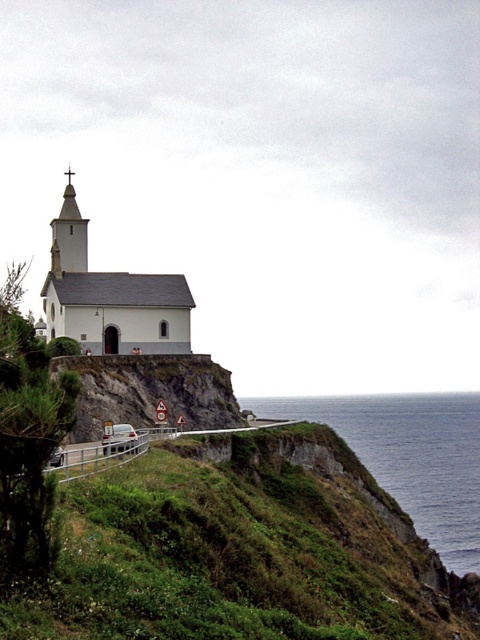
Question: From the image, what is the correct spatial relationship of blue water at lower right in relation to white matte church at center?

Choices:
 (A) below
 (B) above

Answer: (A)

Question: Can you confirm if green grassy hillside at center is bigger than wooden spire at upper left?

Choices:
 (A) no
 (B) yes

Answer: (B)

Question: Which point appears closest to the camera in this image?

Choices:
 (A) 458,424
 (B) 96,515
 (C) 159,348
 (D) 56,259

Answer: (B)

Question: Is green grassy hillside at center in front of wooden spire at upper left?

Choices:
 (A) yes
 (B) no

Answer: (A)

Question: Which point is closer to the camera taking this photo?

Choices:
 (A) (322, 627)
 (B) (142, 328)

Answer: (A)

Question: Which of the following is the closest to the observer?

Choices:
 (A) green grassy hillside at center
 (B) blue water at lower right
 (C) white matte church at center

Answer: (A)